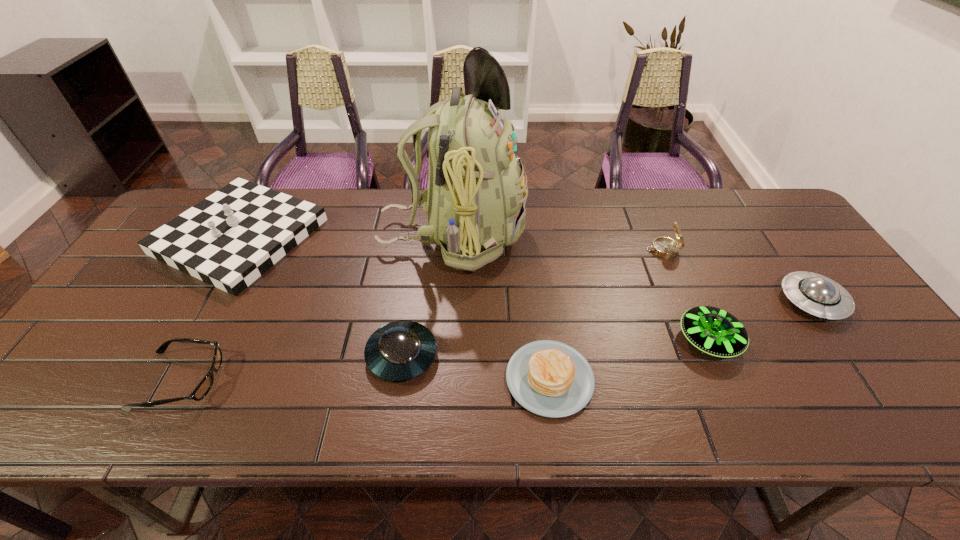
Where is `free point located 0.270m with the dial facing the sixth shortest object`? Image resolution: width=960 pixels, height=540 pixels. free point located 0.270m with the dial facing the sixth shortest object is located at coordinates (554, 250).

This screenshot has height=540, width=960. I want to click on free region located with the dial facing the sixth shortest object, so click(588, 250).

Where is `free spot located 0.270m with the dial facing the sixth shortest object`? Image resolution: width=960 pixels, height=540 pixels. free spot located 0.270m with the dial facing the sixth shortest object is located at coordinates (554, 250).

You are a GUI agent. You are given a task and a screenshot of the screen. Output one action in this format:
    pyautogui.click(x=<x>, y=<y>)
    Task: Click on the free spot located on the right of the second saucer from right to left
    
    Given the screenshot: What is the action you would take?
    pyautogui.click(x=869, y=340)

The height and width of the screenshot is (540, 960). In order to click on blank area located 0.310m on the back of the rightmost saucer in this screenshot , I will do `click(748, 209)`.

Image resolution: width=960 pixels, height=540 pixels. In order to click on vacant space located 0.360m on the right of the shortest saucer in this screenshot , I will do `click(591, 355)`.

This screenshot has height=540, width=960. I want to click on free space located 0.150m on the left of the pancake, so click(439, 379).

Where is `vacant space located on the front-facing side of the spectacles`? This screenshot has height=540, width=960. vacant space located on the front-facing side of the spectacles is located at coordinates (305, 380).

The width and height of the screenshot is (960, 540). Identify the location of backpack situated at the far edge. (475, 200).

Image resolution: width=960 pixels, height=540 pixels. Find the location of `checkerboard that is positioned at the far edge`. checkerboard that is positioned at the far edge is located at coordinates (228, 240).